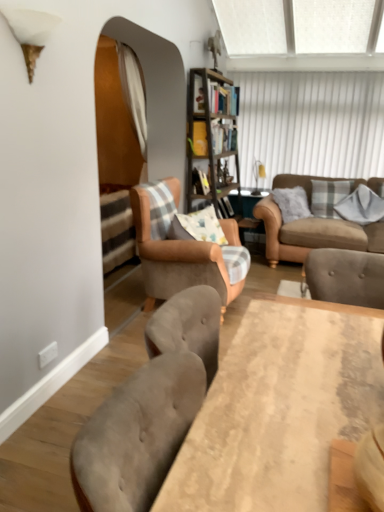
Question: Relative to wooden table at center, is light brown fabric armchair at center in front or behind?

Choices:
 (A) front
 (B) behind

Answer: (B)

Question: Is point (147, 296) positioned closer to the camera than point (319, 398)?

Choices:
 (A) closer
 (B) farther

Answer: (B)

Question: Considering the real-world distances, which object is farthest from the white textured window screen at upper center?

Choices:
 (A) light brown fabric armchair at center
 (B) white fabric curtain at center
 (C) wooden bookshelf at center
 (D) plaid fabric pillow at right, the 2th pillow positioned from the right
 (E) gray cotton pillow at upper right, which is counted as the second pillow, starting from the left

Answer: (A)

Question: Which of these objects is positioned closest to the wooden table at center?

Choices:
 (A) beige fabric couch at right
 (B) white textured window screen at upper center
 (C) plaid fabric pillow at right, the 1th pillow from the left
 (D) wooden bookshelf at center
 (E) white fabric curtain at center

Answer: (A)